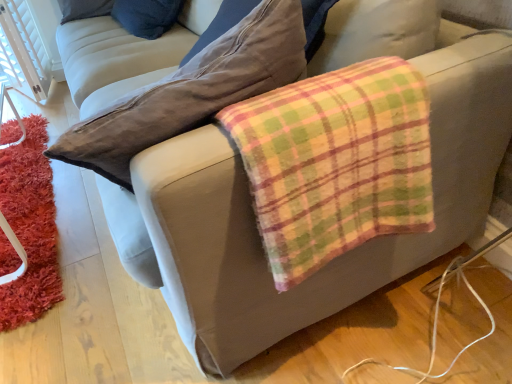
You are a GUI agent. You are given a task and a screenshot of the screen. Output one action in this format:
    pyautogui.click(x=<x>, y=<y>)
    Task: Click on the plaid flannel blanket at lower right
    Image resolution: width=512 pixels, height=384 pixels.
    Given the screenshot: What is the action you would take?
    pyautogui.click(x=335, y=163)

Image resolution: width=512 pixels, height=384 pixels. Describe the element at coordinates (335, 163) in the screenshot. I see `plaid flannel blanket at lower right` at that location.

What do you see at coordinates (30, 227) in the screenshot? This screenshot has height=384, width=512. I see `fluffy orange rug at lower left` at bounding box center [30, 227].

Find the location of a particular element. fluffy orange rug at lower left is located at coordinates (30, 227).

From the picture: In order to face fluffy orange rug at lower left, should I rotate leftwards or rightwards?

To face it directly, rotate left by 29.897 degrees.

This screenshot has width=512, height=384. What are the coordinates of `plaid flannel blanket at lower right` in the screenshot? It's located at (335, 163).

In the image, is fluffy orange rug at lower left on the left side or the right side of plaid flannel blanket at lower right?

fluffy orange rug at lower left is to the left of plaid flannel blanket at lower right.

Which object is more forward, fluffy orange rug at lower left or plaid flannel blanket at lower right?

plaid flannel blanket at lower right is more forward.

Does point (47, 244) lie behind point (389, 131)?

Yes, it is.

From the image's perspective, is fluffy orange rug at lower left positioned above or below plaid flannel blanket at lower right?

Based on their image positions, fluffy orange rug at lower left is located beneath plaid flannel blanket at lower right.

From a real-world perspective, is fluffy orange rug at lower left on plaid flannel blanket at lower right?

No, from a real-world perspective, fluffy orange rug at lower left is not on top of plaid flannel blanket at lower right.

Considering the relative sizes of fluffy orange rug at lower left and plaid flannel blanket at lower right in the image provided, is fluffy orange rug at lower left thinner than plaid flannel blanket at lower right?

No, fluffy orange rug at lower left is not thinner than plaid flannel blanket at lower right.

Can you confirm if fluffy orange rug at lower left is taller than plaid flannel blanket at lower right?

Incorrect, the height of fluffy orange rug at lower left is not larger of that of plaid flannel blanket at lower right.

Considering the relative sizes of fluffy orange rug at lower left and plaid flannel blanket at lower right in the image provided, is fluffy orange rug at lower left bigger than plaid flannel blanket at lower right?

No.

Based on the photo, do you think fluffy orange rug at lower left is within plaid flannel blanket at lower right, or outside of it?

fluffy orange rug at lower left is not inside plaid flannel blanket at lower right, it's outside.

Is fluffy orange rug at lower left in contact with plaid flannel blanket at lower right?

They are not placed beside each other.

Consider the image. Is fluffy orange rug at lower left aimed at plaid flannel blanket at lower right?

A: No, fluffy orange rug at lower left is not oriented towards plaid flannel blanket at lower right.

How many degrees apart are the facing directions of fluffy orange rug at lower left and plaid flannel blanket at lower right?

The angular difference between fluffy orange rug at lower left and plaid flannel blanket at lower right is 84.1 degrees.

Where is `flannel that appears on the right of fluffy orange rug at lower left`? flannel that appears on the right of fluffy orange rug at lower left is located at coordinates (335, 163).

Considering the positions of objects plaid flannel blanket at lower right and fluffy orange rug at lower left in the image provided, who is more to the right, plaid flannel blanket at lower right or fluffy orange rug at lower left?

Positioned to the right is plaid flannel blanket at lower right.

Is plaid flannel blanket at lower right positioned before fluffy orange rug at lower left?

Yes, plaid flannel blanket at lower right is in front of fluffy orange rug at lower left.

Which point is more distant from viewer, (429, 211) or (40, 125)?

Point (40, 125)

From the image's perspective, is plaid flannel blanket at lower right positioned above or below fluffy orange rug at lower left?

plaid flannel blanket at lower right is situated higher than fluffy orange rug at lower left in the image.

Based on the photo, from a real-world perspective, is plaid flannel blanket at lower right located higher than fluffy orange rug at lower left?

Indeed, from a real-world perspective, plaid flannel blanket at lower right stands above fluffy orange rug at lower left.

Considering the relative sizes of plaid flannel blanket at lower right and fluffy orange rug at lower left in the image provided, is plaid flannel blanket at lower right thinner than fluffy orange rug at lower left?

Indeed, plaid flannel blanket at lower right has a lesser width compared to fluffy orange rug at lower left.

Is plaid flannel blanket at lower right taller or shorter than fluffy orange rug at lower left?

plaid flannel blanket at lower right is taller than fluffy orange rug at lower left.

Does plaid flannel blanket at lower right have a smaller size compared to fluffy orange rug at lower left?

No.

Would you say plaid flannel blanket at lower right is outside fluffy orange rug at lower left?

Indeed, plaid flannel blanket at lower right is completely outside fluffy orange rug at lower left.

Is plaid flannel blanket at lower right with fluffy orange rug at lower left?

No, plaid flannel blanket at lower right is not making contact with fluffy orange rug at lower left.

Is plaid flannel blanket at lower right facing away from fluffy orange rug at lower left?

No.

What are the coordinates of `flannel lying in front of the fluffy orange rug at lower left` in the screenshot? It's located at (335, 163).

Identify the location of flannel above the fluffy orange rug at lower left (from a real-world perspective). (335, 163).

I want to click on mat that is under the plaid flannel blanket at lower right (from a real-world perspective), so click(30, 227).